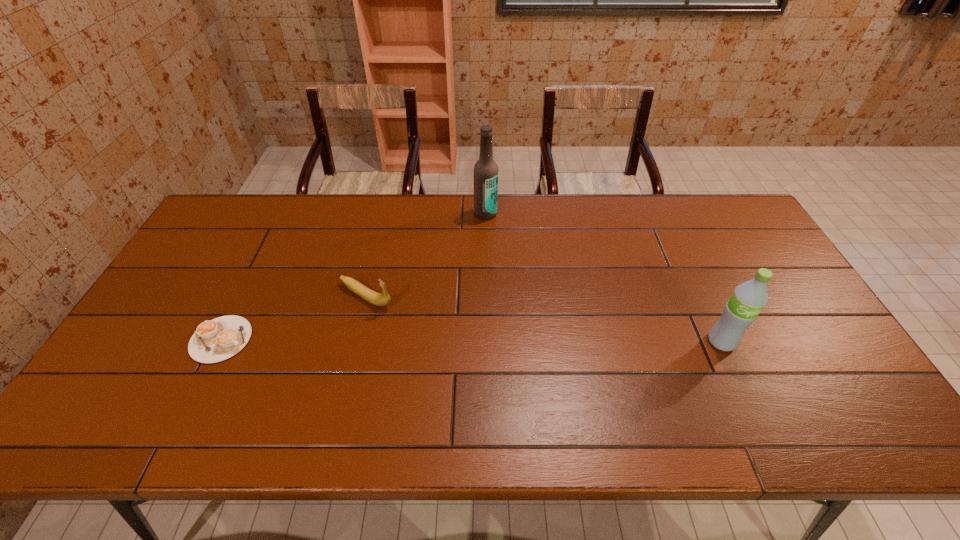
What are the coordinates of `vacant space located 0.280m at the stem of the banana` in the screenshot? It's located at (469, 352).

I want to click on free location located 0.120m at the stem of the banana, so click(421, 324).

The width and height of the screenshot is (960, 540). Identify the location of free spot located 0.280m at the stem of the banana. (469, 352).

Where is `free location located on the side of the tallest object with the label`? Image resolution: width=960 pixels, height=540 pixels. free location located on the side of the tallest object with the label is located at coordinates (490, 306).

The height and width of the screenshot is (540, 960). Identify the location of free space located on the side of the tallest object with the label. pyautogui.click(x=488, y=257).

Where is `free space located 0.140m on the side of the tallest object with the label`? free space located 0.140m on the side of the tallest object with the label is located at coordinates (487, 248).

The image size is (960, 540). What are the coordinates of `object that is at the far edge` in the screenshot? It's located at click(x=485, y=173).

Find the location of a particular element. The width and height of the screenshot is (960, 540). object at the left edge is located at coordinates (215, 340).

Identify the location of vacant area at the far edge of the desktop. (299, 201).

This screenshot has height=540, width=960. In the image, there is a desktop. What are the coordinates of `free space at the near edge` in the screenshot? It's located at (533, 381).